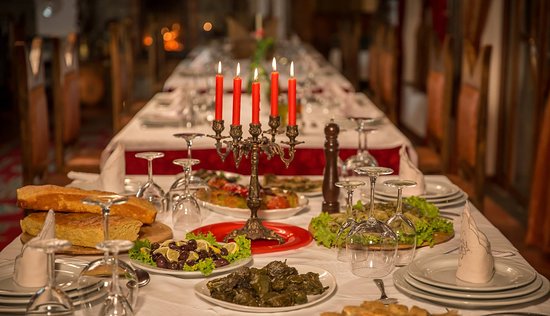
Image resolution: width=550 pixels, height=316 pixels. I want to click on pepper shaker, so click(x=330, y=168).